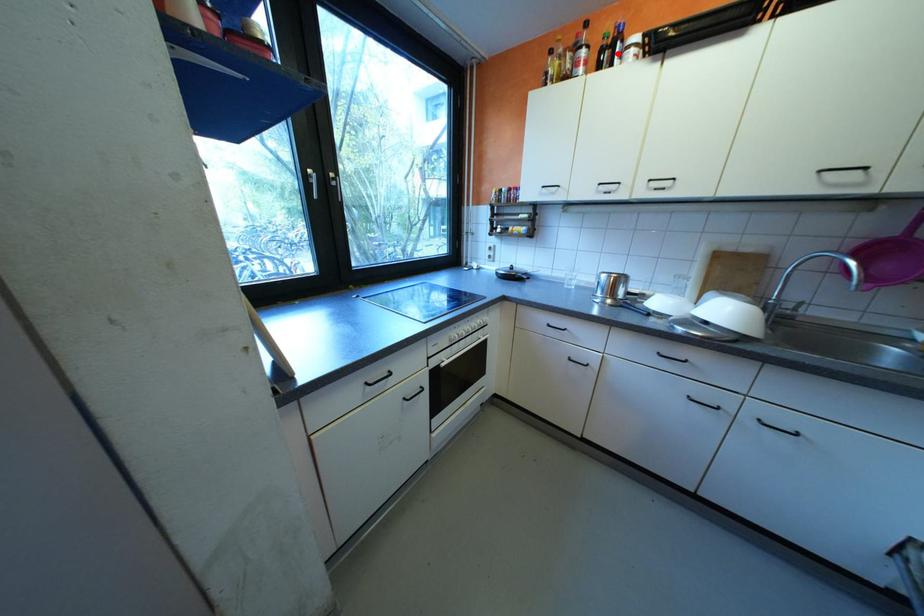
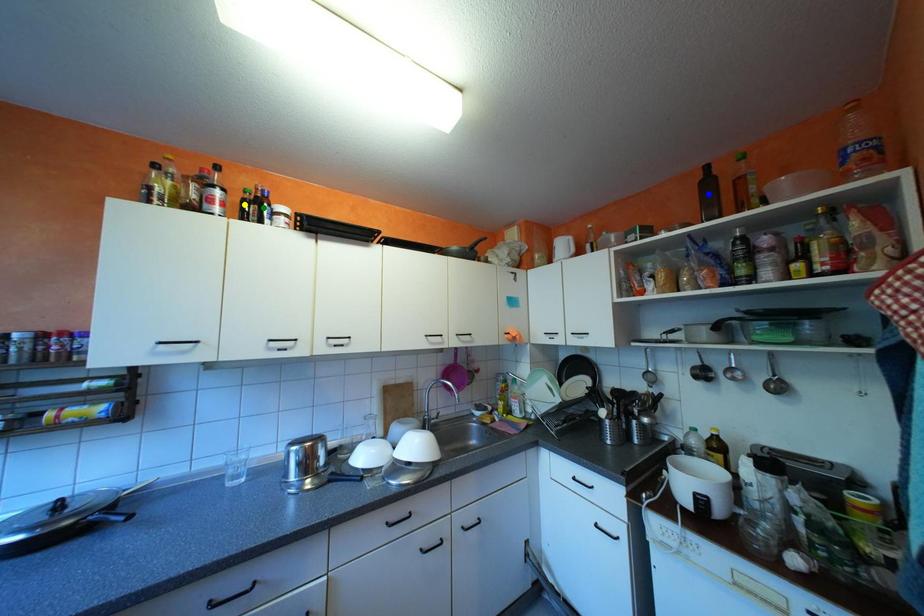
Question: I am providing you with two images of the same scene from different viewpoints. A red point is marked on the first image. You are given multiple points on the second image. Can you choose the point in image 2 that corresponds to the point in image 1?

Choices:
 (A) yellow point
 (B) green point
 (C) blue point

Answer: (B)